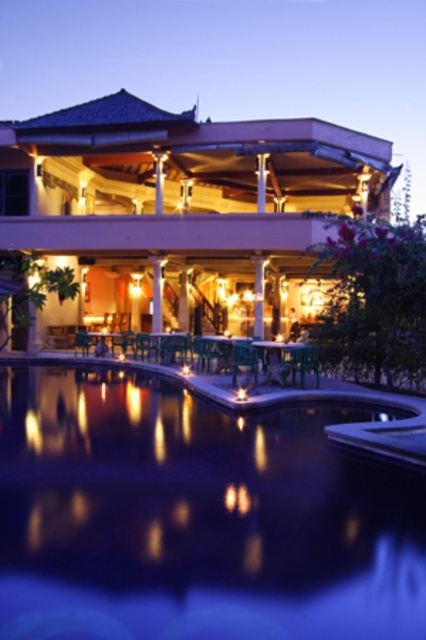
Question: Which point appears farthest from the camera in this image?

Choices:
 (A) (103, 154)
 (B) (238, 355)
 (C) (34, 432)

Answer: (A)

Question: Which object is farther from the camera taking this photo?

Choices:
 (A) wooden patio at center
 (B) green plastic chair at lower center
 (C) smooth glass pool at center

Answer: (A)

Question: Does smooth glass pool at center lie behind green plastic chair at center?

Choices:
 (A) yes
 (B) no

Answer: (B)

Question: Is wooden patio at center below green plastic chair at center?

Choices:
 (A) yes
 (B) no

Answer: (B)

Question: Can you confirm if smooth glass pool at center is smaller than green plastic chair at center?

Choices:
 (A) no
 (B) yes

Answer: (A)

Question: Which is farther from the wooden patio at center?

Choices:
 (A) green plastic chair at center
 (B) smooth glass pool at center
 (C) green plastic chair at lower center

Answer: (B)